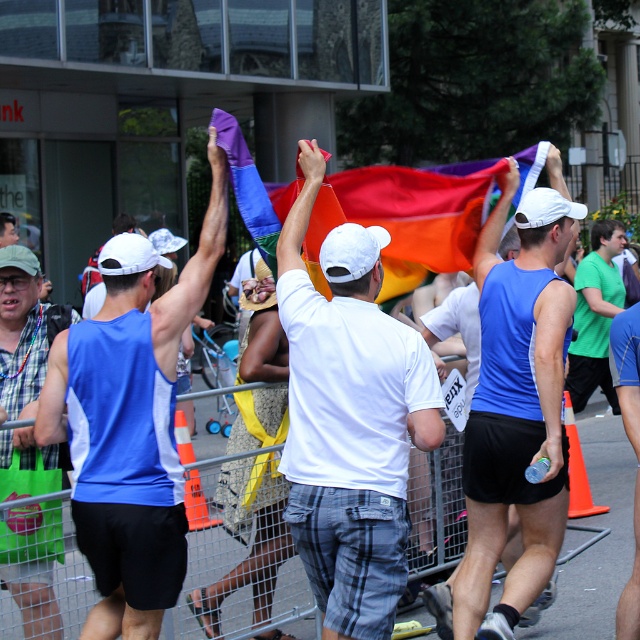
Does white cotton t-shirt at center appear over green matte shirt at center?

Indeed, white cotton t-shirt at center is positioned over green matte shirt at center.

Is white cotton t-shirt at center closer to the viewer compared to green matte shirt at center?

Yes, white cotton t-shirt at center is closer to the viewer.

What do you see at coordinates (349, 419) in the screenshot?
I see `white cotton t-shirt at center` at bounding box center [349, 419].

Identify the location of white cotton t-shirt at center. This screenshot has width=640, height=640. (349, 419).

Is the position of blue fabric flag at center more distant than that of green matte shirt at center?

No, blue fabric flag at center is closer to the viewer.

Is blue fabric flag at center below green matte shirt at center?

Actually, blue fabric flag at center is above green matte shirt at center.

Find the location of a particular element. The height and width of the screenshot is (640, 640). blue fabric flag at center is located at coordinates (516, 406).

Which of these two, white cotton t-shirt at center or blue sleeveless shirt at center, stands taller?

Standing taller between the two is blue sleeveless shirt at center.

Based on the photo, who is shorter, white cotton t-shirt at center or blue sleeveless shirt at center?

white cotton t-shirt at center is shorter.

Between point (390, 420) and point (88, 355), which one is positioned in front?

Positioned in front is point (390, 420).

At what (x,y) coordinates should I click in order to perform the action: click on white cotton t-shirt at center. Please return your answer as a coordinate pair (x, y). Looking at the image, I should click on (349, 419).